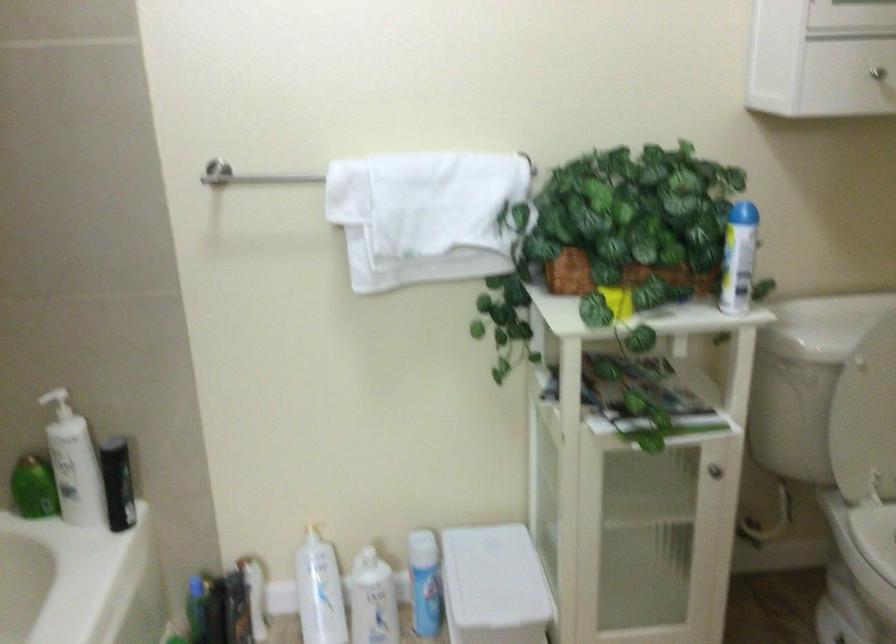
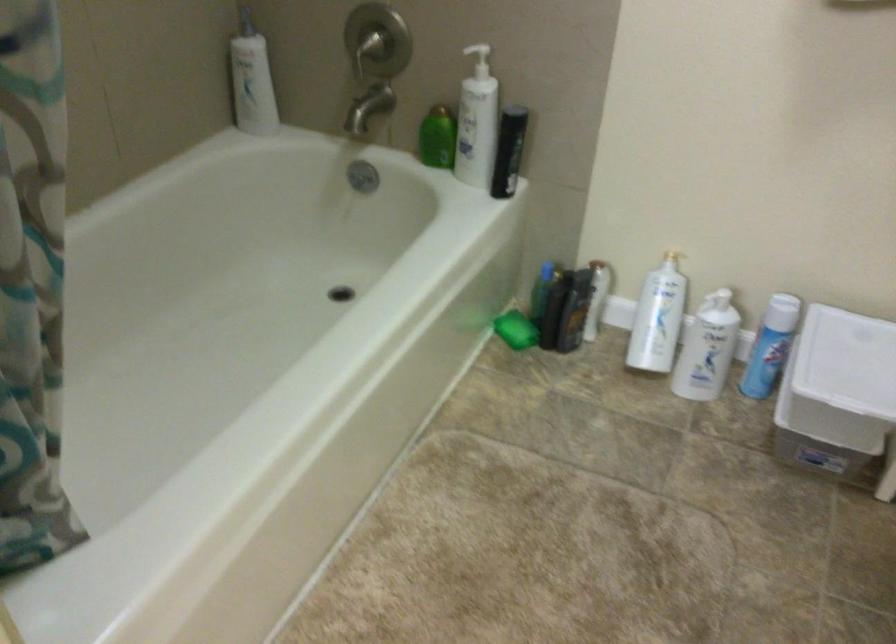
In the second image, find the point that corresponds to (311,522) in the first image.

(672, 249)